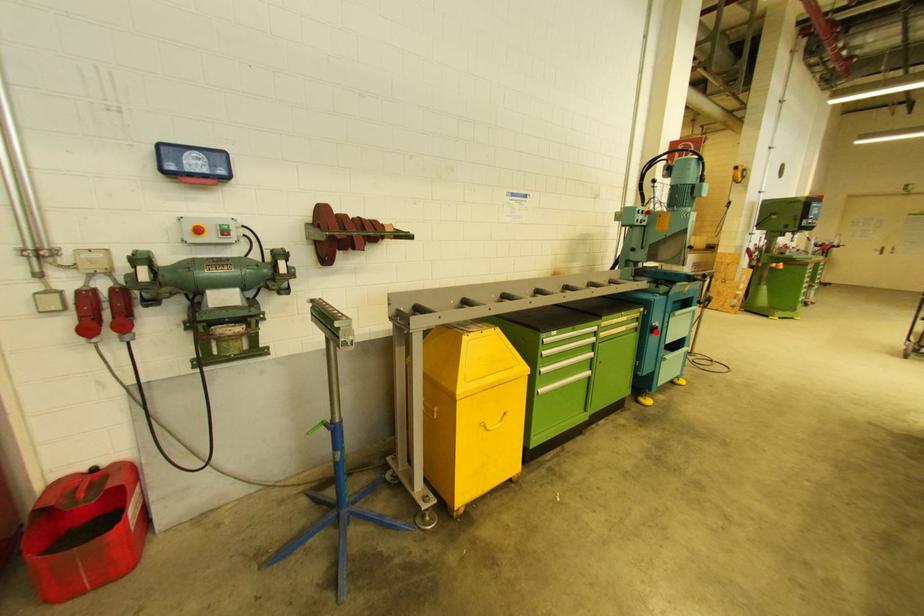
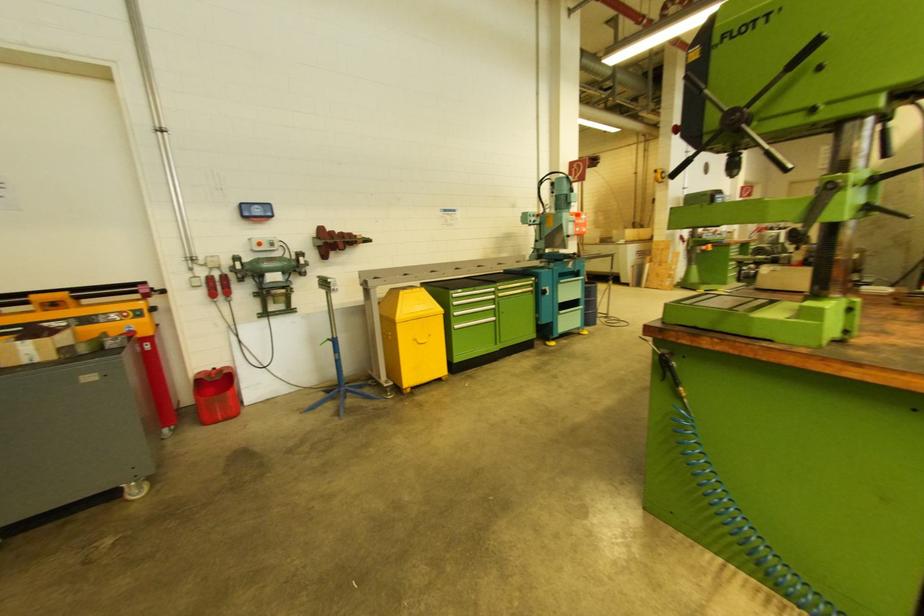
Find the pixel in the second image that matches the highlighted location in the first image.

(545, 294)